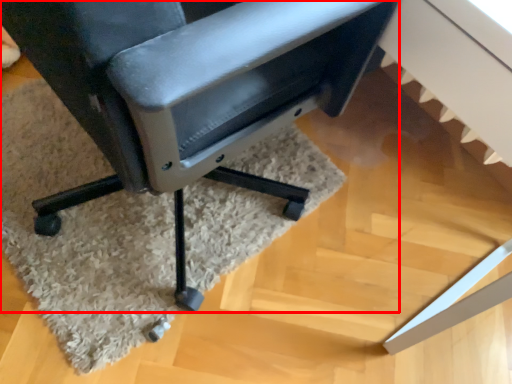
Question: Where is chair (annotated by the red box) located in relation to mat in the image?

Choices:
 (A) left
 (B) right

Answer: (B)